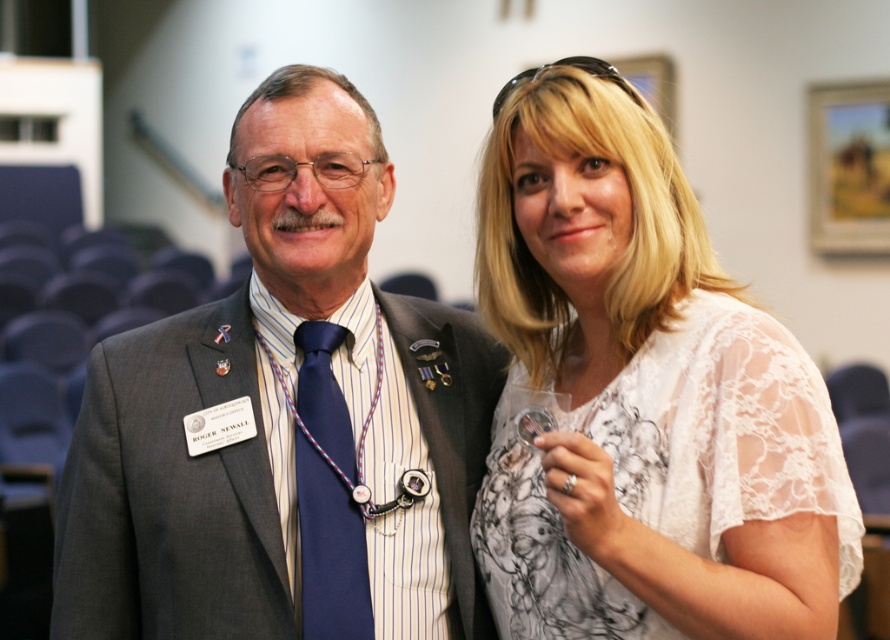
Question: Among these objects, which one is farthest from the camera?

Choices:
 (A) white lace blouse at upper right
 (B) navy blue silk tie at center
 (C) gray suit at center

Answer: (B)

Question: Can you confirm if gray suit at center is thinner than navy blue silk tie at center?

Choices:
 (A) no
 (B) yes

Answer: (A)

Question: Which of these objects is positioned closest to the navy blue silk tie at center?

Choices:
 (A) white lace blouse at upper right
 (B) gray suit at center

Answer: (B)

Question: Is gray suit at center wider than navy blue silk tie at center?

Choices:
 (A) no
 (B) yes

Answer: (B)

Question: Does white lace blouse at upper right have a smaller size compared to navy blue silk tie at center?

Choices:
 (A) yes
 (B) no

Answer: (B)

Question: Which object is closer to the camera taking this photo?

Choices:
 (A) gray suit at center
 (B) white lace blouse at upper right
 (C) navy blue silk tie at center

Answer: (B)